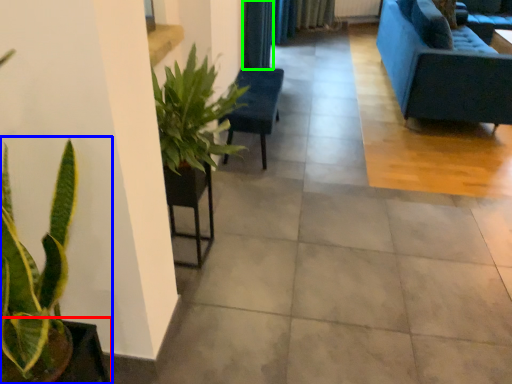
Question: Based on their relative distances, which object is farther from flowerpot (highlighted by a red box)? Choose from houseplant (highlighted by a blue box) and curtain (highlighted by a green box).

Choices:
 (A) houseplant
 (B) curtain

Answer: (B)